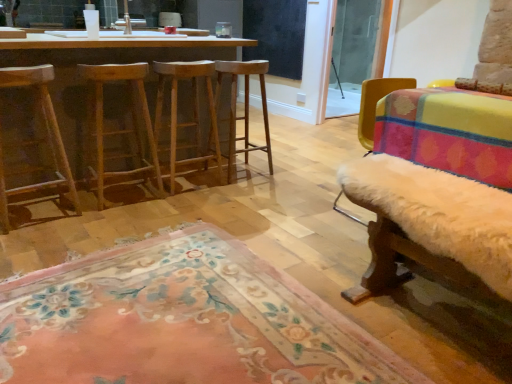
The height and width of the screenshot is (384, 512). Identify the location of free point in front of natural wood stool at center, acting as the first stool starting from the left. (119, 221).